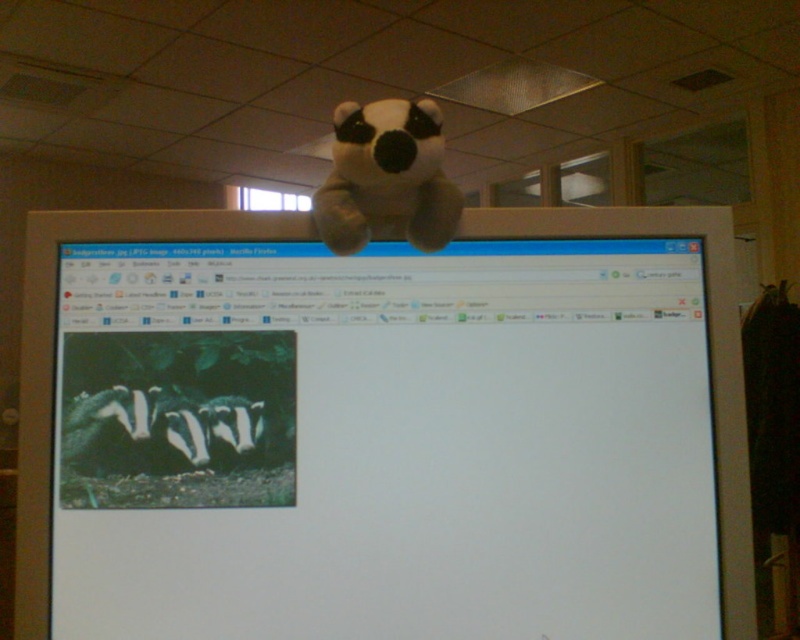
Question: Is white matte monitor at center thinner than soft plush panda at upper center?

Choices:
 (A) yes
 (B) no

Answer: (B)

Question: Does white matte monitor at center come behind soft plush panda at upper center?

Choices:
 (A) no
 (B) yes

Answer: (A)

Question: Which point is closer to the camera?

Choices:
 (A) soft plush panda at upper center
 (B) white matte monitor at center

Answer: (B)

Question: Can you confirm if white matte monitor at center is positioned above soft plush panda at upper center?

Choices:
 (A) no
 (B) yes

Answer: (A)